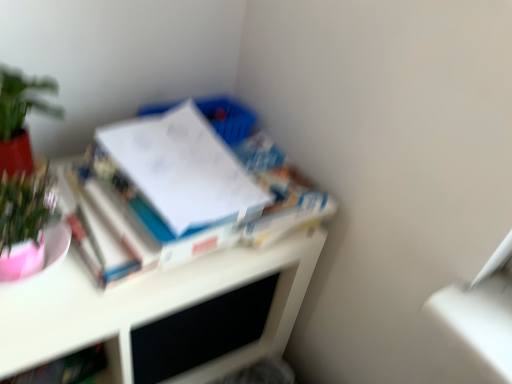
Question: Is white glossy book at upper left, the second book when ordered from left to right, completely or partially inside white glossy desk at upper left?

Choices:
 (A) yes
 (B) no

Answer: (B)

Question: Is white glossy desk at upper left placed right next to white glossy book at upper left, the second book when ordered from left to right?

Choices:
 (A) no
 (B) yes

Answer: (A)

Question: From the image's perspective, would you say white glossy desk at upper left is positioned over white glossy book at upper left, the first book in the right-to-left sequence?

Choices:
 (A) yes
 (B) no

Answer: (B)

Question: From the image's perspective, does white glossy desk at upper left appear lower than white glossy book at upper left, the second book when ordered from left to right?

Choices:
 (A) no
 (B) yes

Answer: (B)

Question: Is white glossy desk at upper left looking in the opposite direction of white glossy book at upper left, acting as the 2th book starting from the bottom?

Choices:
 (A) yes
 (B) no

Answer: (B)

Question: Is white glossy book at upper left, the second book when ordered from left to right, in front of or behind white glossy desk at upper left in the image?

Choices:
 (A) front
 (B) behind

Answer: (B)

Question: From a real-world perspective, is white glossy book at upper left, the first book in the right-to-left sequence, physically located above or below white glossy desk at upper left?

Choices:
 (A) above
 (B) below

Answer: (A)

Question: Choose the correct answer: Is white glossy book at upper left, the 1th book positioned from the top, inside white glossy desk at upper left or outside it?

Choices:
 (A) outside
 (B) inside

Answer: (A)

Question: From the image's perspective, relative to white glossy desk at upper left, is white glossy book at upper left, the 1th book positioned from the top, above or below?

Choices:
 (A) below
 (B) above

Answer: (B)

Question: Considering the positions of hardcover book at lower left, which is the 2th book from right to left, and white glossy book at upper left, the 1th book positioned from the top, in the image, is hardcover book at lower left, which is the 2th book from right to left, wider or thinner than white glossy book at upper left, the 1th book positioned from the top,?

Choices:
 (A) wide
 (B) thin

Answer: (B)

Question: Based on their positions, is hardcover book at lower left, which is the first book in bottom-to-top order, located to the left or right of white glossy book at upper left, the 1th book positioned from the top?

Choices:
 (A) right
 (B) left

Answer: (B)

Question: From a real-world perspective, relative to white glossy book at upper left, acting as the 2th book starting from the bottom, is hardcover book at lower left, which is the 2th book from right to left, vertically above or below?

Choices:
 (A) below
 (B) above

Answer: (A)

Question: Considering the positions of hardcover book at lower left, arranged as the first book when viewed from the left, and white glossy book at upper left, the 1th book positioned from the top, in the image, is hardcover book at lower left, arranged as the first book when viewed from the left, taller or shorter than white glossy book at upper left, the 1th book positioned from the top,?

Choices:
 (A) tall
 (B) short

Answer: (B)

Question: Choose the correct answer: Is green matte plant at upper left inside white glossy book at upper left, the first book in the right-to-left sequence, or outside it?

Choices:
 (A) inside
 (B) outside

Answer: (B)

Question: Considering the relative positions of green matte plant at upper left and white glossy book at upper left, the 1th book positioned from the top, in the image provided, is green matte plant at upper left to the left or to the right of white glossy book at upper left, the 1th book positioned from the top,?

Choices:
 (A) left
 (B) right

Answer: (A)